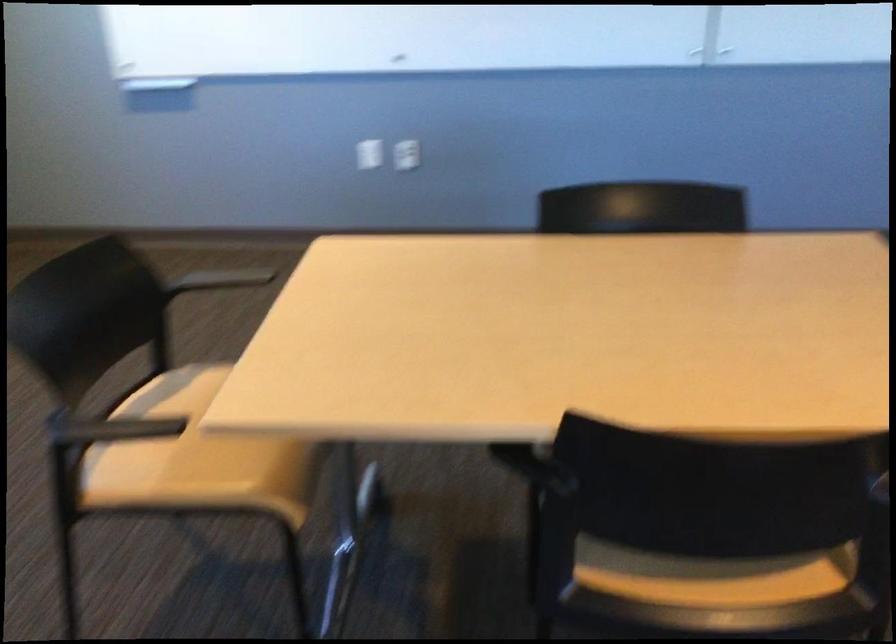
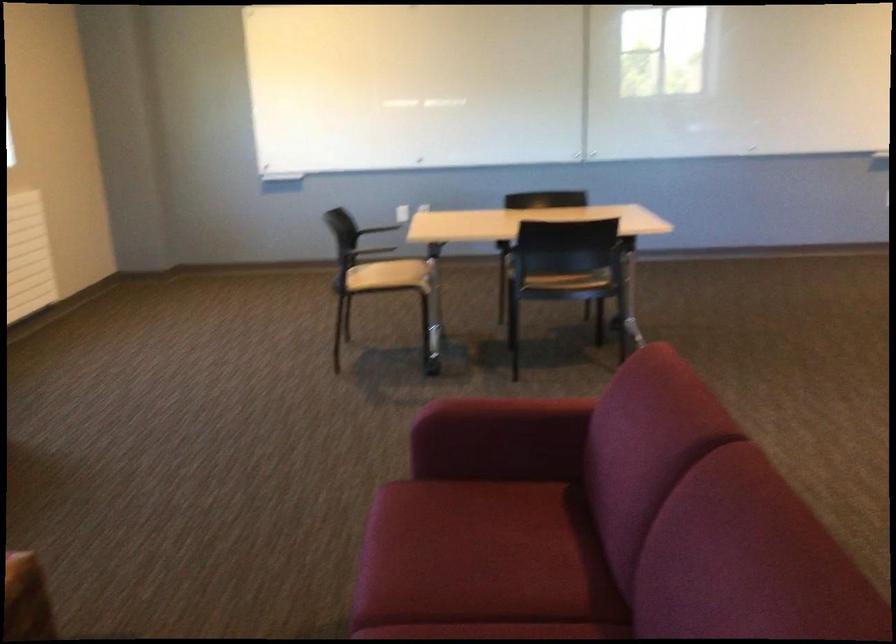
Question: What movement of the cameraman would produce the second image?

Choices:
 (A) Left
 (B) Right
 (C) Forward
 (D) Backward

Answer: (D)